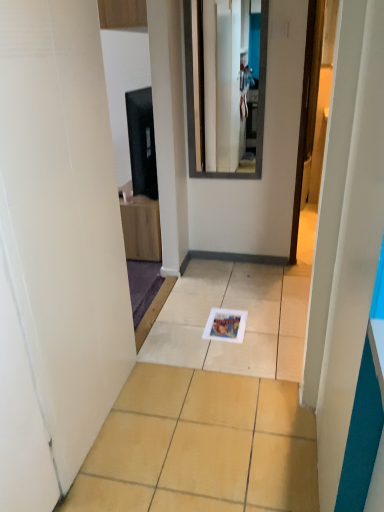
Identify the location of vacant region above white glossy tile at center (from a real-world perspective). The image size is (384, 512). (229, 366).